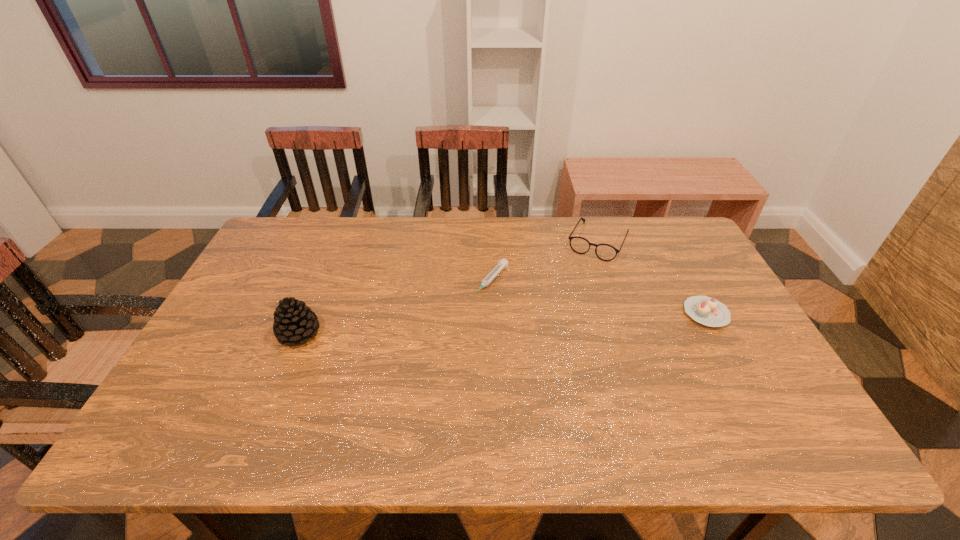
Image resolution: width=960 pixels, height=540 pixels. In the image, there is a desktop. Identify the location of vacant area at the left edge. (252, 278).

The height and width of the screenshot is (540, 960). I want to click on vacant space at the right edge of the desktop, so click(687, 317).

I want to click on vacant region at the far left corner of the desktop, so (305, 246).

In the image, there is a desktop. Where is `free space at the near left corner`? This screenshot has height=540, width=960. free space at the near left corner is located at coordinates (179, 384).

In order to click on free space that is in between the third object from left to right and the tallest object in this screenshot , I will do `click(448, 288)`.

The image size is (960, 540). Identify the location of free space between the cupcake and the syringe. (598, 297).

Locate an element on the screen. The image size is (960, 540). free spot between the leftmost object and the third object from left to right is located at coordinates (448, 288).

You are a GUI agent. You are given a task and a screenshot of the screen. Output one action in this format:
    pyautogui.click(x=<x>, y=<y>)
    Task: Click on the vacant area that lies between the pinecone and the second tallest object
    
    Given the screenshot: What is the action you would take?
    pyautogui.click(x=448, y=288)

Find the location of a particular element. vacant space that's between the leftmost object and the cupcake is located at coordinates (502, 323).

You are a GUI agent. You are given a task and a screenshot of the screen. Output one action in this format:
    pyautogui.click(x=<x>, y=<y>)
    Task: Click on the vacant area between the tallest object and the spectacles
    The height and width of the screenshot is (540, 960).
    Given the screenshot: What is the action you would take?
    pyautogui.click(x=448, y=288)